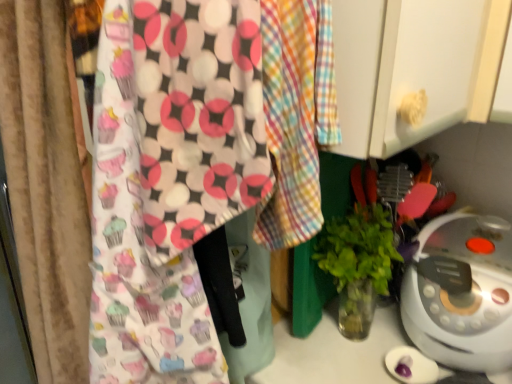
Question: Can you confirm if green leafy plant in clear glass vase at center-right is wider than cupcake-patterned fabric at center?

Choices:
 (A) no
 (B) yes

Answer: (A)

Question: Is green leafy plant in clear glass vase at center-right in front of cupcake-patterned fabric at center?

Choices:
 (A) no
 (B) yes

Answer: (A)

Question: Is green leafy plant in clear glass vase at center-right behind cupcake-patterned fabric at center?

Choices:
 (A) no
 (B) yes

Answer: (B)

Question: Is green leafy plant in clear glass vase at center-right facing away from cupcake-patterned fabric at center?

Choices:
 (A) no
 (B) yes

Answer: (A)

Question: Could you tell me if green leafy plant in clear glass vase at center-right is turned towards cupcake-patterned fabric at center?

Choices:
 (A) no
 (B) yes

Answer: (A)

Question: Considering the relative sizes of green leafy plant in clear glass vase at center-right and cupcake-patterned fabric at center in the image provided, is green leafy plant in clear glass vase at center-right bigger than cupcake-patterned fabric at center?

Choices:
 (A) no
 (B) yes

Answer: (A)

Question: From a real-world perspective, is white plastic rice cooker at lower right on top of green leafy plant in clear glass vase at center-right?

Choices:
 (A) no
 (B) yes

Answer: (A)

Question: Does white plastic rice cooker at lower right appear on the right side of green leafy plant in clear glass vase at center-right?

Choices:
 (A) yes
 (B) no

Answer: (A)

Question: From the image's perspective, is white plastic rice cooker at lower right located beneath green leafy plant in clear glass vase at center-right?

Choices:
 (A) yes
 (B) no

Answer: (A)

Question: Is white plastic rice cooker at lower right positioned far away from green leafy plant in clear glass vase at center-right?

Choices:
 (A) no
 (B) yes

Answer: (A)

Question: Is white plastic rice cooker at lower right behind green leafy plant in clear glass vase at center-right?

Choices:
 (A) yes
 (B) no

Answer: (B)

Question: Considering the relative positions of white plastic rice cooker at lower right and green leafy plant in clear glass vase at center-right in the image provided, is white plastic rice cooker at lower right to the left of green leafy plant in clear glass vase at center-right from the viewer's perspective?

Choices:
 (A) yes
 (B) no

Answer: (B)

Question: Is white plastic rice cooker at lower right inside cupcake-patterned fabric at center?

Choices:
 (A) yes
 (B) no

Answer: (B)